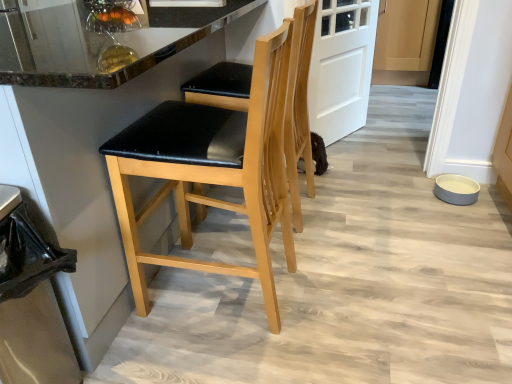
Question: From their relative heights in the image, would you say gray matte bowl at lower right is taller or shorter than black leather stool at left?

Choices:
 (A) short
 (B) tall

Answer: (A)

Question: Does point (470, 178) appear closer or farther from the camera than point (123, 276)?

Choices:
 (A) farther
 (B) closer

Answer: (A)

Question: Which of these objects is positioned closest to the matte black seat at center, placed as the 2th chair when sorted from front to back?

Choices:
 (A) black leather stool at left, the first chair from the front
 (B) white matte door at center
 (C) gray matte bowl at lower right
 (D) black leather stool at left
 (E) black plastic trash can at lower left

Answer: (A)

Question: Which object is positioned closest to the white matte door at center?

Choices:
 (A) light wood cabinet at center
 (B) gray matte bowl at lower right
 (C) matte black seat at center, placed as the 2th chair when sorted from front to back
 (D) black leather stool at left, the first chair from the front
 (E) black leather stool at left

Answer: (C)